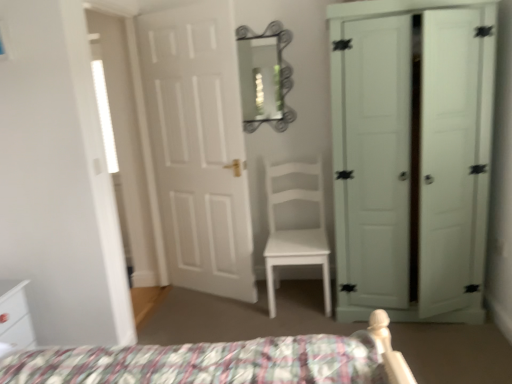
Question: In terms of size, does white glossy nightstand at lower left appear bigger or smaller than white matte chair at center?

Choices:
 (A) big
 (B) small

Answer: (B)

Question: In the image, is white glossy nightstand at lower left on the left side or the right side of white matte chair at center?

Choices:
 (A) right
 (B) left

Answer: (B)

Question: Which object is the closest to the metallic silver mirror at upper center?

Choices:
 (A) white matte door at right, which is the second door from left to right
 (B) white matte door at center, which is counted as the first door, starting from the left
 (C) white matte chair at center
 (D) white glossy nightstand at lower left

Answer: (B)

Question: Based on their relative distances, which object is farther from the white matte door at right, marked as the first door in a right-to-left arrangement?

Choices:
 (A) white glossy nightstand at lower left
 (B) white matte chair at center
 (C) white matte door at center, marked as the 2th door in a right-to-left arrangement
 (D) metallic silver mirror at upper center

Answer: (A)